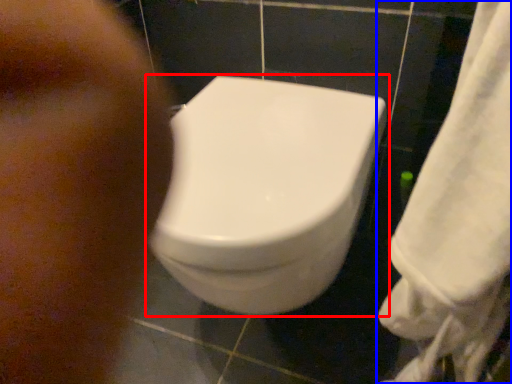
Question: Which object is closer to the camera taking this photo, toilet (highlighted by a red box) or towel (highlighted by a blue box)?

Choices:
 (A) toilet
 (B) towel

Answer: (B)